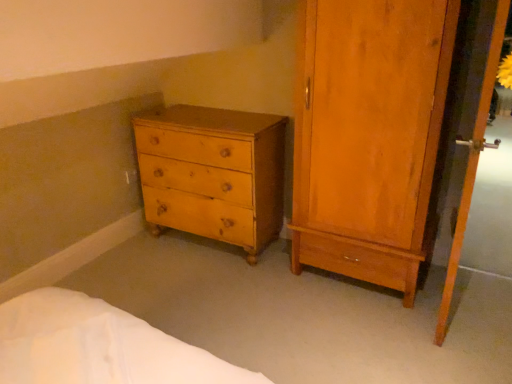
What are the coordinates of `blank area to the left of wooden screen door at right` in the screenshot? It's located at (366, 326).